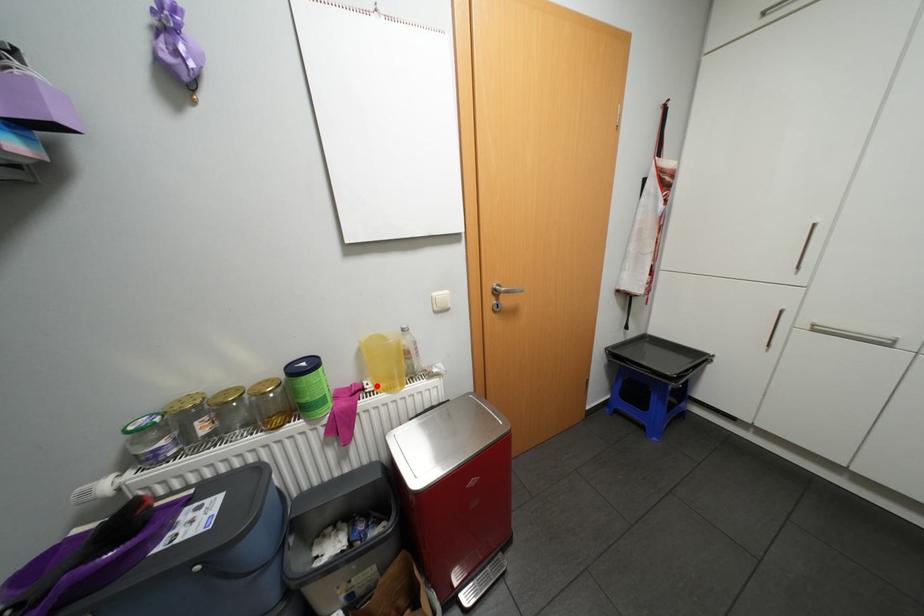
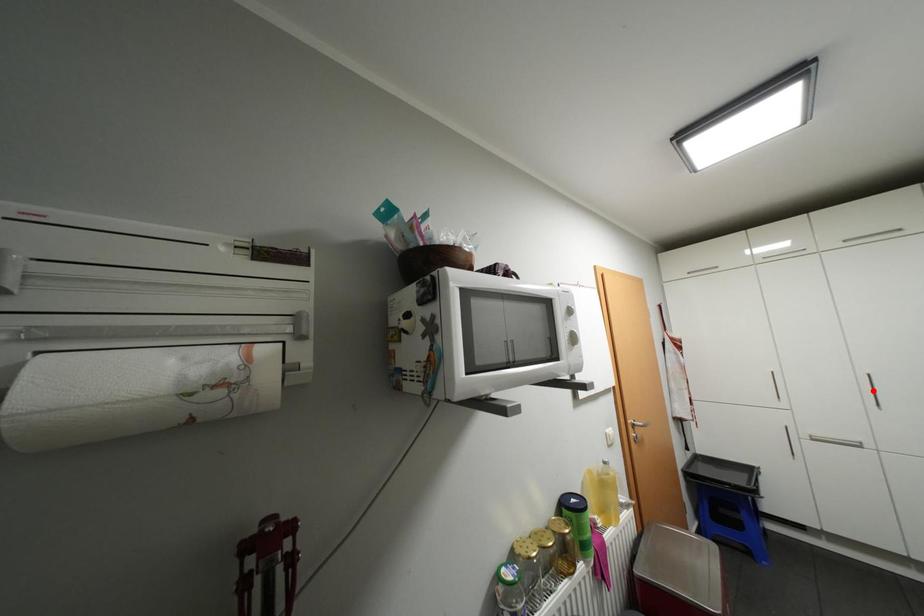
I am providing you with two images of the same scene from different viewpoints. A red point is marked on the first image and another point is marked on the second image. Are the points marked in image1 and image2 representing the same 3D position?

No